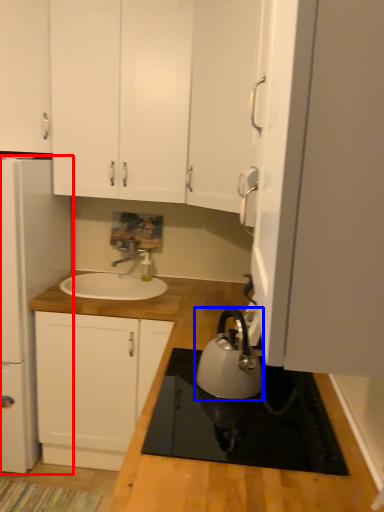
Question: Which of the following is the closest to the observer, home appliance (highlighted by a red box) or kitchen appliance (highlighted by a blue box)?

Choices:
 (A) home appliance
 (B) kitchen appliance

Answer: (B)